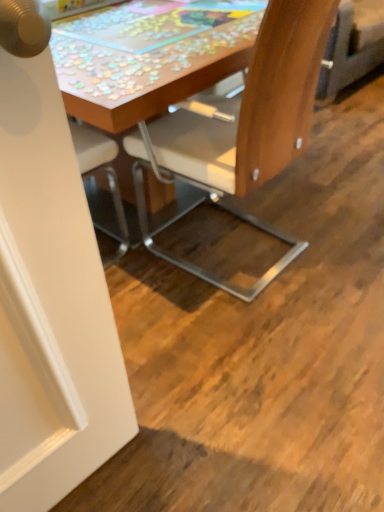
Locate an element on the screen. vacant space to the right of wooden chair at center is located at coordinates (342, 230).